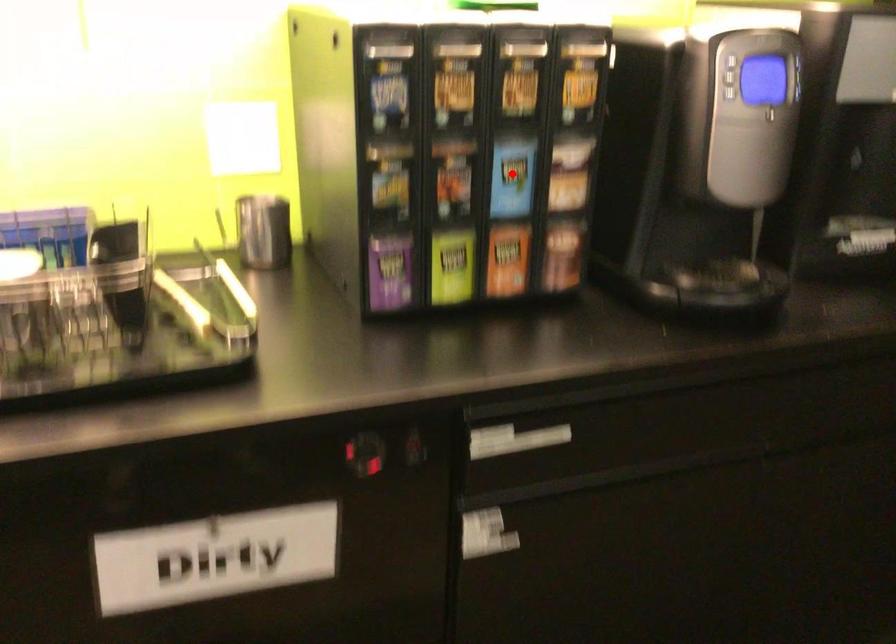
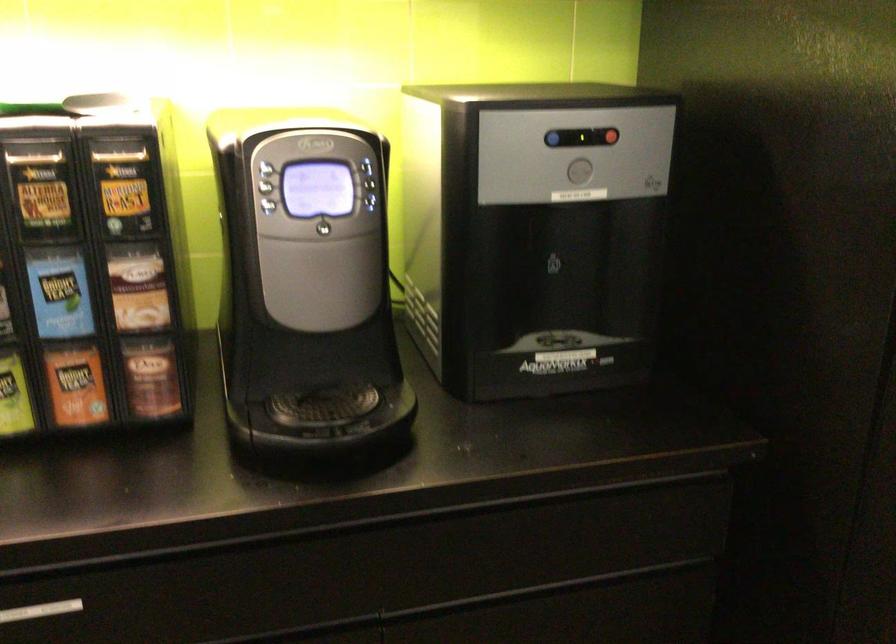
Question: A red point is marked in image1. In image2, is the corresponding 3D point closer to the camera or farther? Reply with the corresponding letter.

Choices:
 (A) The corresponding 3D point is closer.
 (B) The corresponding 3D point is farther.

Answer: (A)